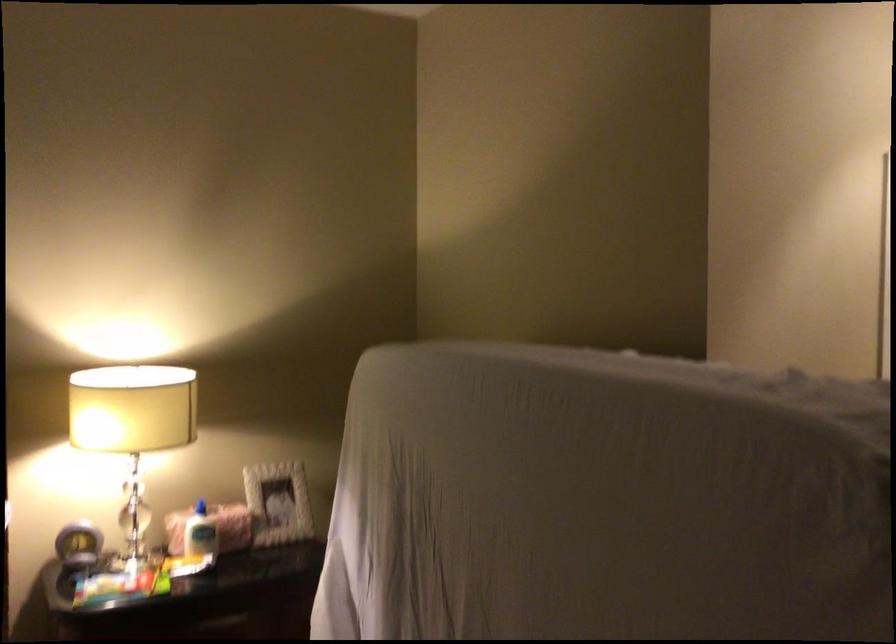
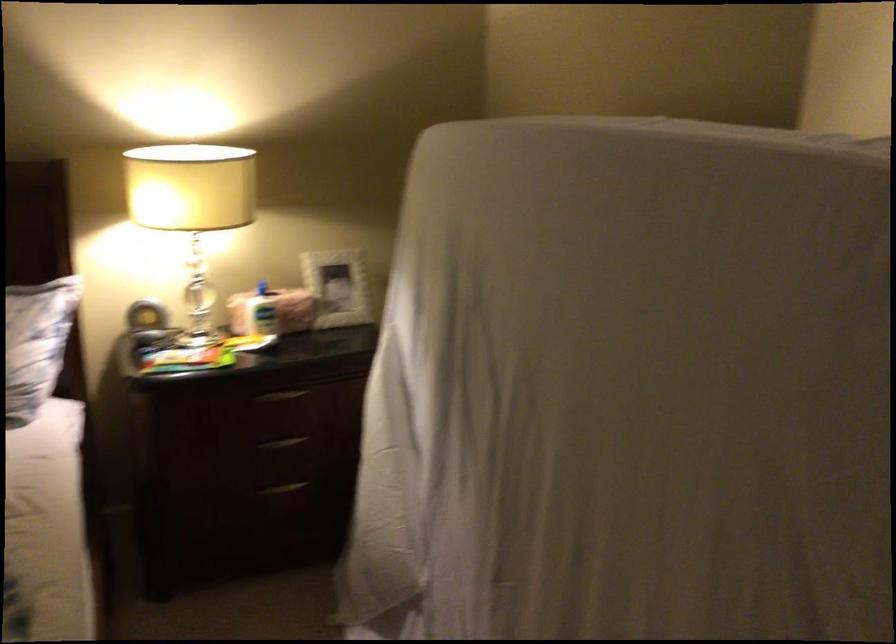
Question: I am providing you with two images of the same scene from different viewpoints. Which of the following objects are not visible in image2?

Choices:
 (A) dark drawer handle
 (B) small round clock
 (C) lotion pump top
 (D) none of these

Answer: (D)